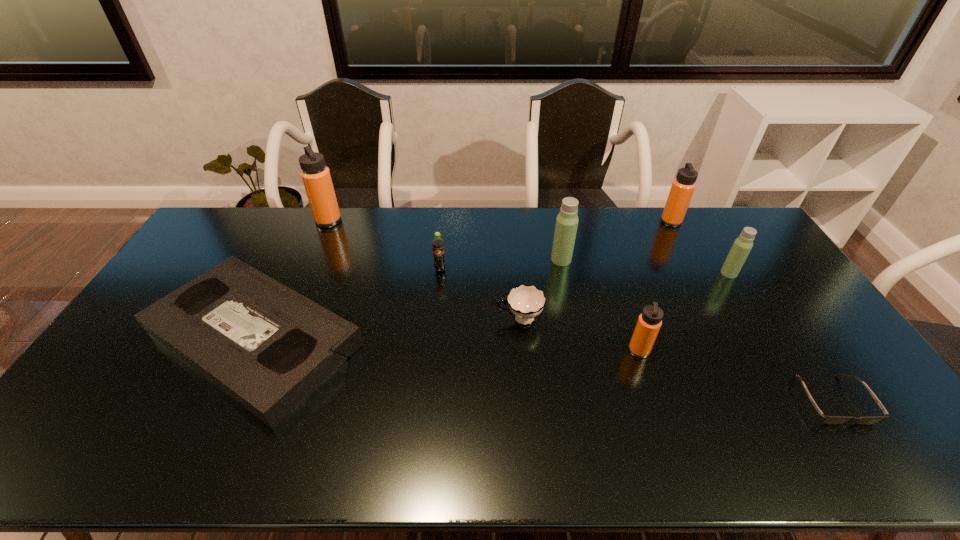
Find the location of a particular element. The width and height of the screenshot is (960, 540). orange thermos bottle that stands as the closest to the second biggest orange thermos bottle is located at coordinates 649,322.